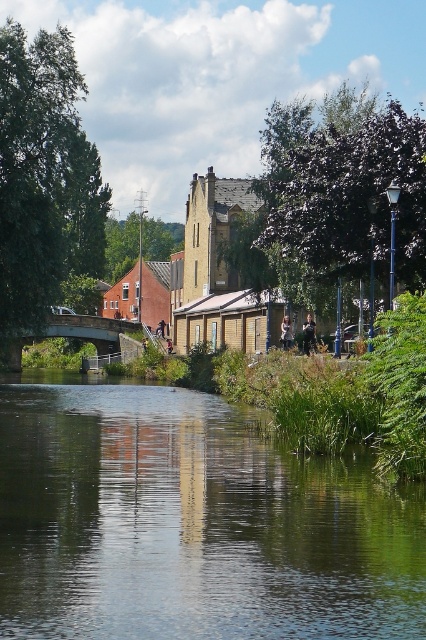
Question: Which point is closer to the camera?

Choices:
 (A) (192, 481)
 (B) (287, 316)

Answer: (A)

Question: Does dark brown leather jacket at center appear on the right side of light brown leather jacket at center?

Choices:
 (A) yes
 (B) no

Answer: (A)

Question: Which object is positioned farthest from the light brown leather jacket at center?

Choices:
 (A) dark brown leather jacket at center
 (B) green reflective water at center

Answer: (B)

Question: Considering the relative positions of green reflective water at center and dark brown leather jacket at center in the image provided, where is green reflective water at center located with respect to dark brown leather jacket at center?

Choices:
 (A) above
 (B) below

Answer: (B)

Question: Which object is the closest to the green reflective water at center?

Choices:
 (A) dark brown leather jacket at center
 (B) light brown leather jacket at center

Answer: (B)

Question: Is green reflective water at center thinner than light brown leather jacket at center?

Choices:
 (A) no
 (B) yes

Answer: (A)